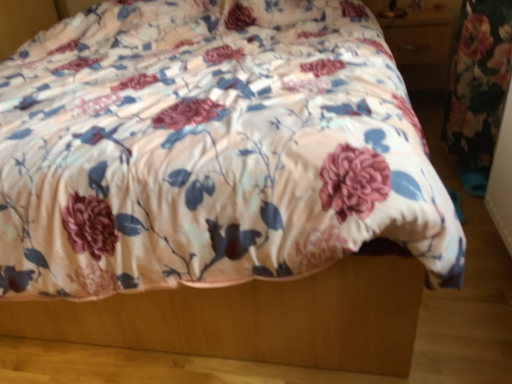
Question: Is wooden drawer at upper right outside floral fabric bed at center?

Choices:
 (A) yes
 (B) no

Answer: (A)

Question: From the image's perspective, is wooden drawer at upper right below floral fabric bed at center?

Choices:
 (A) yes
 (B) no

Answer: (B)

Question: Is wooden drawer at upper right not near floral fabric bed at center?

Choices:
 (A) yes
 (B) no

Answer: (A)

Question: Considering the relative positions of wooden drawer at upper right and floral fabric bed at center in the image provided, is wooden drawer at upper right to the left of floral fabric bed at center from the viewer's perspective?

Choices:
 (A) no
 (B) yes

Answer: (A)

Question: Can you confirm if wooden drawer at upper right is bigger than floral fabric bed at center?

Choices:
 (A) no
 (B) yes

Answer: (A)

Question: Is wooden drawer at upper right positioned before floral fabric bed at center?

Choices:
 (A) no
 (B) yes

Answer: (A)

Question: From a real-world perspective, is floral fabric bed at center located higher than wooden drawer at upper right?

Choices:
 (A) no
 (B) yes

Answer: (A)

Question: Is the depth of floral fabric bed at center greater than that of wooden drawer at upper right?

Choices:
 (A) no
 (B) yes

Answer: (A)

Question: Is floral fabric bed at center shorter than wooden drawer at upper right?

Choices:
 (A) yes
 (B) no

Answer: (B)

Question: Is floral fabric bed at center next to wooden drawer at upper right?

Choices:
 (A) no
 (B) yes

Answer: (A)

Question: Is floral fabric bed at center at the right side of wooden drawer at upper right?

Choices:
 (A) yes
 (B) no

Answer: (B)

Question: Does floral fabric bed at center have a greater height compared to wooden drawer at upper right?

Choices:
 (A) no
 (B) yes

Answer: (B)

Question: From a real-world perspective, is floral fabric bed at center physically located above or below wooden drawer at upper right?

Choices:
 (A) above
 (B) below

Answer: (B)